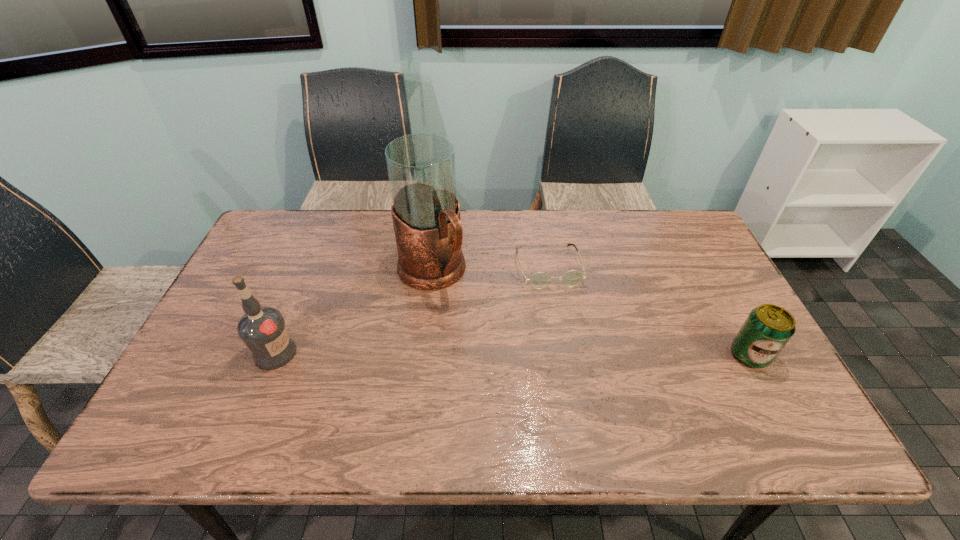
The image size is (960, 540). In the image, there is a desktop. What are the coordinates of `vacant space at the far edge` in the screenshot? It's located at (595, 232).

Image resolution: width=960 pixels, height=540 pixels. Find the location of `blank area at the near edge`. blank area at the near edge is located at coordinates (606, 394).

Identify the location of free location at the left edge of the desktop. 220,333.

Find the location of `vacant space at the right edge`. vacant space at the right edge is located at coordinates (703, 289).

In the image, there is a desktop. Where is `free space at the far left corner`? The width and height of the screenshot is (960, 540). free space at the far left corner is located at coordinates (305, 215).

The width and height of the screenshot is (960, 540). What are the coordinates of `vacant space at the near left corner of the desktop` in the screenshot? It's located at (225, 407).

In the image, there is a desktop. At what (x,y) coordinates should I click in order to perform the action: click on free region at the far right corner. Please return your answer as a coordinate pair (x, y). This screenshot has height=540, width=960. Looking at the image, I should click on (671, 228).

Image resolution: width=960 pixels, height=540 pixels. In order to click on vacant region between the shortest object and the second tallest object in this screenshot , I will do `click(412, 309)`.

You are a GUI agent. You are given a task and a screenshot of the screen. Output one action in this format:
    pyautogui.click(x=<x>, y=<y>)
    Task: Click on the free space between the pitcher and the leftmost object
    This screenshot has height=540, width=960.
    Given the screenshot: What is the action you would take?
    pyautogui.click(x=353, y=313)

Locate an element on the screen. free area in between the spectacles and the second tallest object is located at coordinates [412, 309].